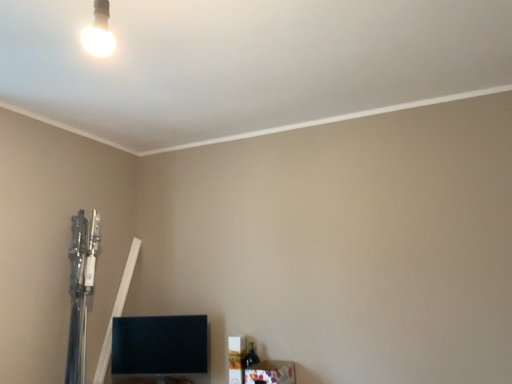
Describe the element at coordinates (270, 373) in the screenshot. I see `wooden frame at lower right, which is counted as the 2th furniture, starting from the back` at that location.

Image resolution: width=512 pixels, height=384 pixels. What do you see at coordinates (159, 348) in the screenshot?
I see `black glossy tv at lower left, which ranks as the first furniture in back-to-front order` at bounding box center [159, 348].

At what (x,y) coordinates should I click in order to perform the action: click on wooden frame at lower right, which is the 1th furniture from right to left. Please return your answer as a coordinate pair (x, y). Looking at the image, I should click on (270, 373).

Which of these two, white glossy bulb at upper left or black glossy tv at lower left, the 2th furniture viewed from the right, is smaller?

white glossy bulb at upper left is smaller.

Is white glossy bulb at upper left looking in the opposite direction of black glossy tv at lower left, acting as the second furniture starting from the front?

No, white glossy bulb at upper left is not facing the opposite direction of black glossy tv at lower left, acting as the second furniture starting from the front.

Is there a large distance between white glossy bulb at upper left and black glossy tv at lower left, which ranks as the first furniture in back-to-front order?

Absolutely, white glossy bulb at upper left is distant from black glossy tv at lower left, which ranks as the first furniture in back-to-front order.

Considering the relative positions of white glossy bulb at upper left and wooden frame at lower right, which is counted as the 2th furniture, starting from the back, in the image provided, is white glossy bulb at upper left in front of wooden frame at lower right, which is counted as the 2th furniture, starting from the back,?

Yes, it is in front of wooden frame at lower right, which is counted as the 2th furniture, starting from the back.

What's the angular difference between white glossy bulb at upper left and wooden frame at lower right, which is the 1th furniture from right to left,'s facing directions?

The angular difference between white glossy bulb at upper left and wooden frame at lower right, which is the 1th furniture from right to left, is 90.2 degrees.

Based on the photo, would you say wooden frame at lower right, which is the 1th furniture from right to left, is part of white glossy bulb at upper left's contents?

That's incorrect, wooden frame at lower right, which is the 1th furniture from right to left, is not inside white glossy bulb at upper left.

Starting from the white glossy bulb at upper left, which furniture is the 1st one behind? Please provide its 2D coordinates.

[(270, 373)]

Which object is thinner, black glossy tv at lower left, which ranks as the first furniture in back-to-front order, or wooden frame at lower right, which is the 1th furniture from right to left?

With smaller width is black glossy tv at lower left, which ranks as the first furniture in back-to-front order.

Between black glossy tv at lower left, which ranks as the first furniture in back-to-front order, and wooden frame at lower right, positioned as the second furniture in left-to-right order, which one has less height?

With less height is wooden frame at lower right, positioned as the second furniture in left-to-right order.

From the image's perspective, is black glossy tv at lower left, the 2th furniture viewed from the right, above or below wooden frame at lower right, which ranks as the 1th furniture in front-to-back order?

From the image's perspective, black glossy tv at lower left, the 2th furniture viewed from the right, appears above wooden frame at lower right, which ranks as the 1th furniture in front-to-back order.

Could you tell me if black glossy tv at lower left, the first furniture positioned from the left, is facing wooden frame at lower right, which is counted as the 2th furniture, starting from the back?

No, black glossy tv at lower left, the first furniture positioned from the left, is not turned towards wooden frame at lower right, which is counted as the 2th furniture, starting from the back.

Does wooden frame at lower right, positioned as the second furniture in left-to-right order, have a lesser height compared to white glossy bulb at upper left?

Indeed, wooden frame at lower right, positioned as the second furniture in left-to-right order, has a lesser height compared to white glossy bulb at upper left.

How different are the orientations of wooden frame at lower right, positioned as the second furniture in left-to-right order, and white glossy bulb at upper left in degrees?

90.2 degrees.

Looking at this image, could you tell me if wooden frame at lower right, which ranks as the 1th furniture in front-to-back order, is facing white glossy bulb at upper left?

No, wooden frame at lower right, which ranks as the 1th furniture in front-to-back order, does not turn towards white glossy bulb at upper left.

Is wooden frame at lower right, which is counted as the 2th furniture, starting from the back, surrounding white glossy bulb at upper left?

No, white glossy bulb at upper left is not surrounded by wooden frame at lower right, which is counted as the 2th furniture, starting from the back.

Identify the location of furniture above the wooden frame at lower right, which ranks as the 1th furniture in front-to-back order (from the image's perspective). This screenshot has height=384, width=512. (159, 348).

Between wooden frame at lower right, positioned as the second furniture in left-to-right order, and black glossy tv at lower left, which ranks as the first furniture in back-to-front order, which one has larger size?

Bigger between the two is black glossy tv at lower left, which ranks as the first furniture in back-to-front order.

Which of these two, wooden frame at lower right, which is the 1th furniture from right to left, or black glossy tv at lower left, which ranks as the first furniture in back-to-front order, stands shorter?

Standing shorter between the two is wooden frame at lower right, which is the 1th furniture from right to left.

From the image's perspective, between black glossy tv at lower left, the first furniture positioned from the left, and white glossy bulb at upper left, which one is located above?

white glossy bulb at upper left is shown above in the image.

Is black glossy tv at lower left, which ranks as the first furniture in back-to-front order, far from white glossy bulb at upper left?

Yes, black glossy tv at lower left, which ranks as the first furniture in back-to-front order, and white glossy bulb at upper left are quite far apart.

Is black glossy tv at lower left, which ranks as the first furniture in back-to-front order, at the right side of white glossy bulb at upper left?

No, black glossy tv at lower left, which ranks as the first furniture in back-to-front order, is not to the right of white glossy bulb at upper left.

This screenshot has width=512, height=384. In order to click on lamp lying above the black glossy tv at lower left, which ranks as the first furniture in back-to-front order (from the image's perspective) in this screenshot , I will do `click(99, 32)`.

Locate an element on the screen. lamp in front of the wooden frame at lower right, positioned as the second furniture in left-to-right order is located at coordinates (99, 32).

Looking at this image, which object lies further to the anchor point black glossy tv at lower left, the 2th furniture viewed from the right, wooden frame at lower right, positioned as the second furniture in left-to-right order, or white glossy bulb at upper left?

white glossy bulb at upper left is positioned further to the anchor black glossy tv at lower left, the 2th furniture viewed from the right.

Looking at the image, which one is located further to white glossy bulb at upper left, black glossy tv at lower left, acting as the second furniture starting from the front, or wooden frame at lower right, which is the 1th furniture from right to left?

Based on the image, wooden frame at lower right, which is the 1th furniture from right to left, appears to be further to white glossy bulb at upper left.

Which object lies further to the anchor point wooden frame at lower right, positioned as the second furniture in left-to-right order, white glossy bulb at upper left or black glossy tv at lower left, the first furniture positioned from the left?

white glossy bulb at upper left is further to wooden frame at lower right, positioned as the second furniture in left-to-right order.

Estimate the real-world distances between objects in this image. Which object is further from wooden frame at lower right, which ranks as the 1th furniture in front-to-back order, black glossy tv at lower left, the first furniture positioned from the left, or white glossy bulb at upper left?

white glossy bulb at upper left is further to wooden frame at lower right, which ranks as the 1th furniture in front-to-back order.

Estimate the real-world distances between objects in this image. Which object is further from black glossy tv at lower left, the 2th furniture viewed from the right, white glossy bulb at upper left or wooden frame at lower right, positioned as the second furniture in left-to-right order?

white glossy bulb at upper left is positioned further to the anchor black glossy tv at lower left, the 2th furniture viewed from the right.

From the image, which object appears to be farther from white glossy bulb at upper left, wooden frame at lower right, positioned as the second furniture in left-to-right order, or black glossy tv at lower left, acting as the second furniture starting from the front?

The object further to white glossy bulb at upper left is wooden frame at lower right, positioned as the second furniture in left-to-right order.

I want to click on furniture that lies between white glossy bulb at upper left and wooden frame at lower right, which is the 1th furniture from right to left, from top to bottom, so click(159, 348).